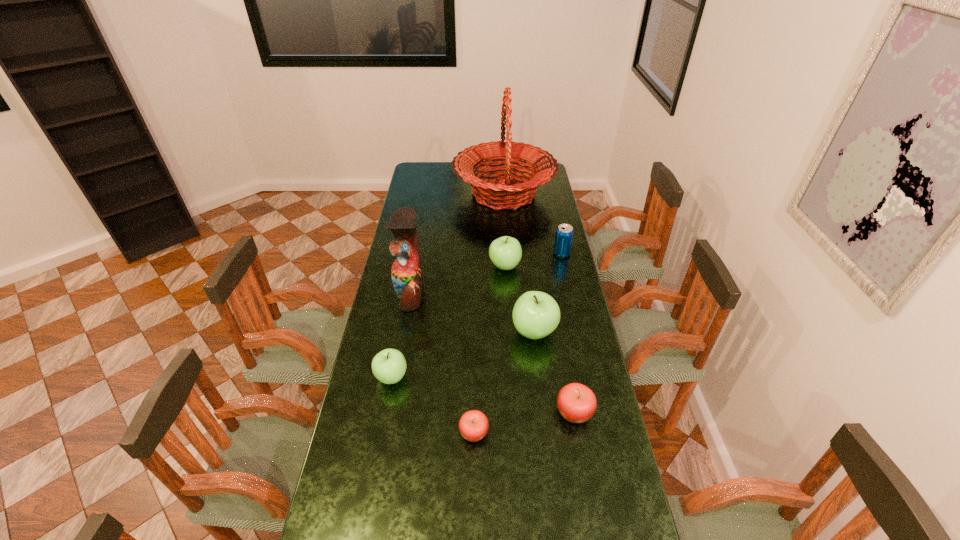
You are a GUI agent. You are given a task and a screenshot of the screen. Output one action in this format:
    pyautogui.click(x=<x>, y=<y>)
    Task: Click on the bigger red apple
    
    Given the screenshot: What is the action you would take?
    pyautogui.click(x=577, y=403)

This screenshot has width=960, height=540. What are the coordinates of `the smaller red apple` in the screenshot? It's located at (473, 425).

The width and height of the screenshot is (960, 540). I want to click on the shortest object, so click(473, 425).

Identify the location of free space located 0.080m on the left of the tallest object. This screenshot has height=540, width=960. (438, 194).

At what (x,y) coordinates should I click in order to perform the action: click on vacant area situated 0.400m at the face of the second tallest object. Please return your answer as a coordinate pair (x, y). The width and height of the screenshot is (960, 540). Looking at the image, I should click on (522, 292).

You are a GUI agent. You are given a task and a screenshot of the screen. Output one action in this format:
    pyautogui.click(x=<x>, y=<y>)
    Task: Click on the vacant region located on the back of the fifth farthest object
    This screenshot has height=540, width=960.
    Given the screenshot: What is the action you would take?
    pyautogui.click(x=525, y=256)

At what (x,y) coordinates should I click in order to perform the action: click on vacant region located on the back of the farthest apple. Please return your answer as a coordinate pair (x, y). This screenshot has width=960, height=540. Looking at the image, I should click on (502, 226).

Where is `blank space located 0.160m on the front of the blue pop soda`? This screenshot has width=960, height=540. blank space located 0.160m on the front of the blue pop soda is located at coordinates pos(568,283).

You are a GUI agent. You are given a task and a screenshot of the screen. Output one action in this format:
    pyautogui.click(x=<x>, y=<y>)
    Task: Click on the free location located 0.370m on the back of the leftmost green apple
    
    Given the screenshot: What is the action you would take?
    pyautogui.click(x=407, y=291)

Locate an element on the screen. Image resolution: width=960 pixels, height=540 pixels. free space located 0.250m on the front of the right red apple is located at coordinates (593, 518).